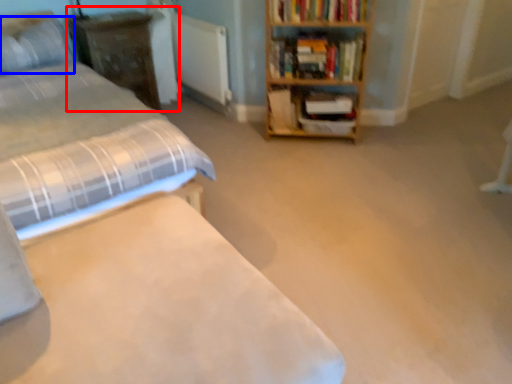
Question: Which object is further to the camera taking this photo, dresser (highlighted by a red box) or pillow (highlighted by a blue box)?

Choices:
 (A) dresser
 (B) pillow

Answer: (A)